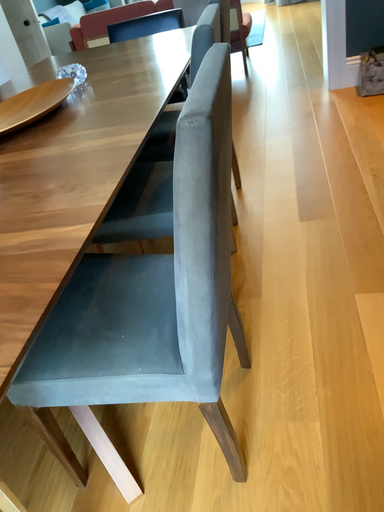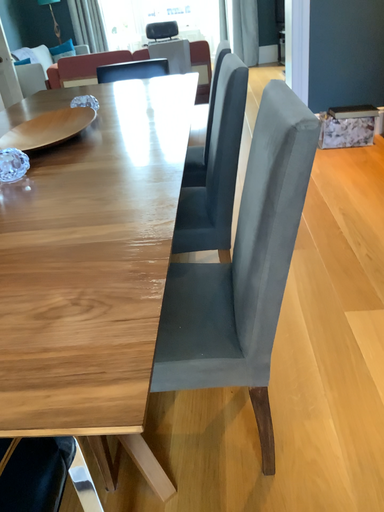
Question: Which way did the camera rotate in the video?

Choices:
 (A) rotated left
 (B) rotated right

Answer: (B)